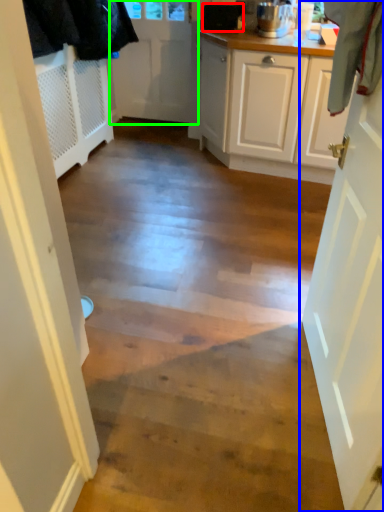
Question: Based on their relative distances, which object is farther from appliance (highlighted by a red box)? Choose from door (highlighted by a blue box) and door (highlighted by a green box).

Choices:
 (A) door
 (B) door

Answer: (A)